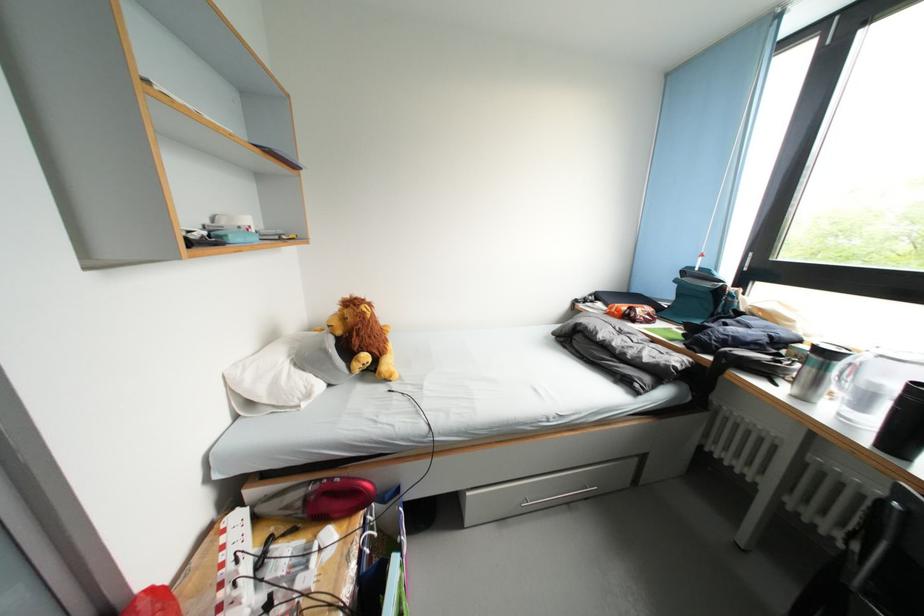
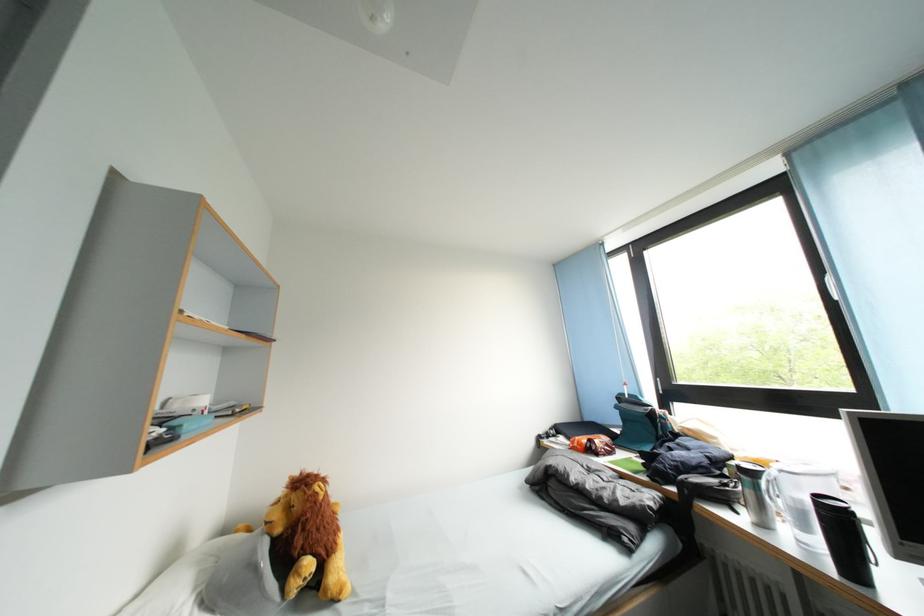
Locate, in the second image, the point that corresponds to point (835, 360) in the first image.

(759, 479)